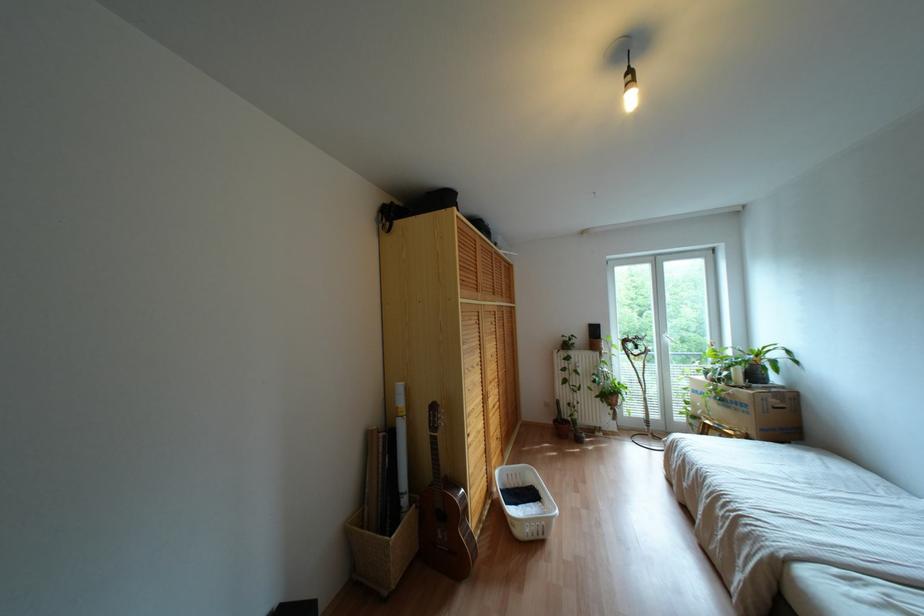
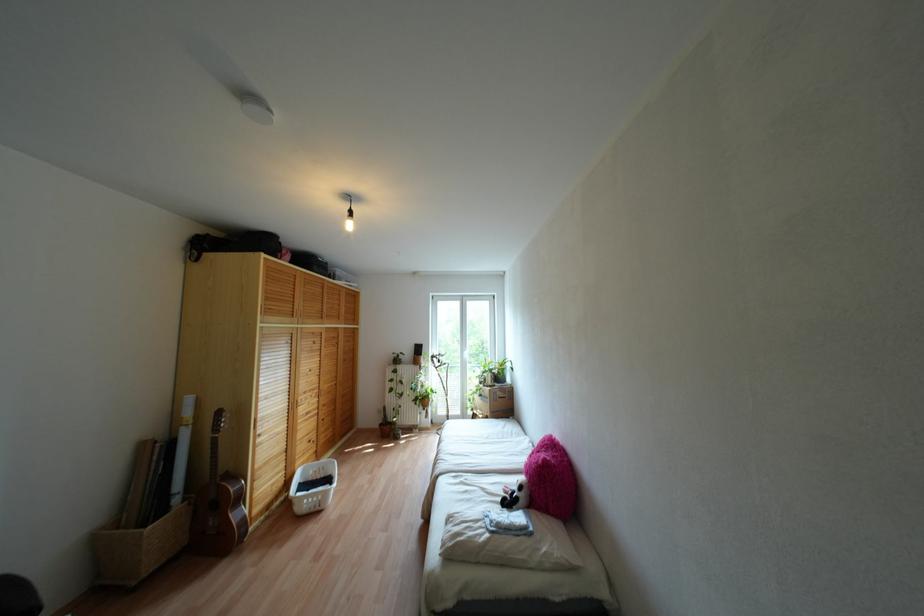
In the second image, find the point that corresponds to the point at 387,231 in the first image.

(196, 260)